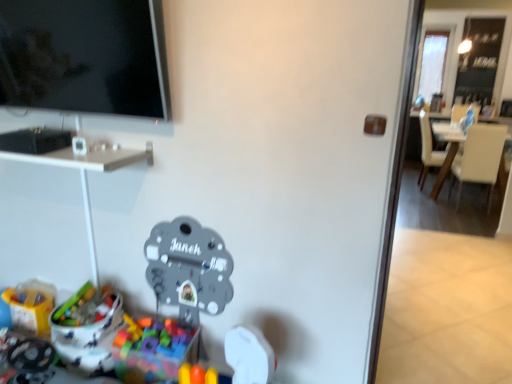
Question: Is point (420, 134) positioned closer to the camera than point (474, 114)?

Choices:
 (A) closer
 (B) farther

Answer: (B)

Question: Visually, is white leather chair at right, arranged as the 2th chair when viewed from the front, positioned to the left or to the right of white leather armchair at upper right?

Choices:
 (A) right
 (B) left

Answer: (B)

Question: Based on their relative distances, which object is farther from the white leather chair at right, the 2th chair positioned from the back?

Choices:
 (A) white leather armchair at upper right
 (B) white leather chair at right, positioned as the first chair in back-to-front order
 (C) multicolored plastic blocks at lower left, arranged as the 2th toy when viewed from the left
 (D) plastic toy at lower left, the first toy positioned from the left
 (E) white glossy desk at upper left

Answer: (D)

Question: Estimate the real-world distances between objects in this image. Which object is farther from the white glossy desk at upper left?

Choices:
 (A) multicolored plastic blocks at lower left, which ranks as the second toy in right-to-left order
 (B) metallic gray clock at center, the third toy positioned from the left
 (C) plastic toy at lower left, the first toy positioned from the left
 (D) white leather armchair at upper right
 (E) white leather chair at right, which is the first chair in front-to-back order

Answer: (D)